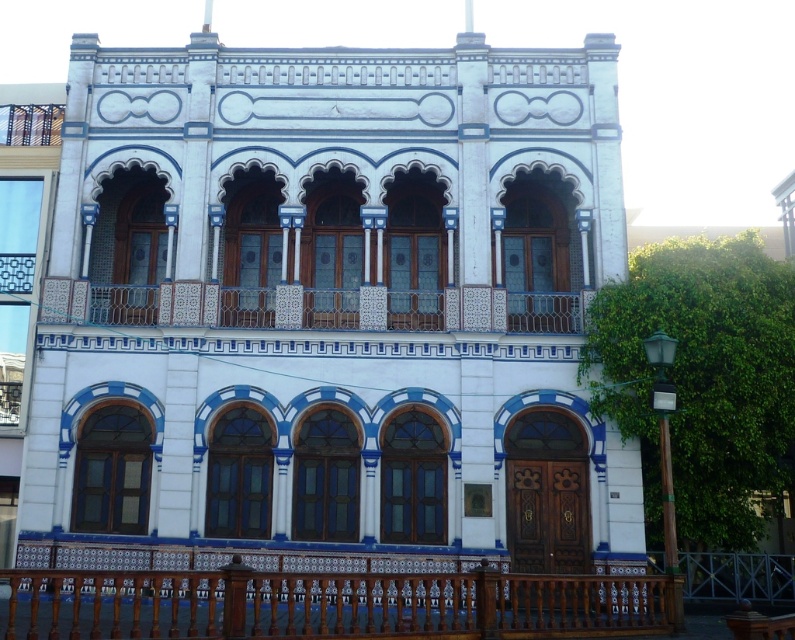
Can you confirm if brown wooden balustrade at lower center is positioned below white ceramic balcony at center?

Correct, brown wooden balustrade at lower center is located below white ceramic balcony at center.

Does brown wooden balustrade at lower center appear over white ceramic balcony at center?

No, brown wooden balustrade at lower center is not above white ceramic balcony at center.

Is point (530, 582) more distant than point (280, 312)?

That is False.

At what (x,y) coordinates should I click in order to perform the action: click on brown wooden balustrade at lower center. Please return your answer as a coordinate pair (x, y). Image resolution: width=795 pixels, height=640 pixels. Looking at the image, I should click on (328, 604).